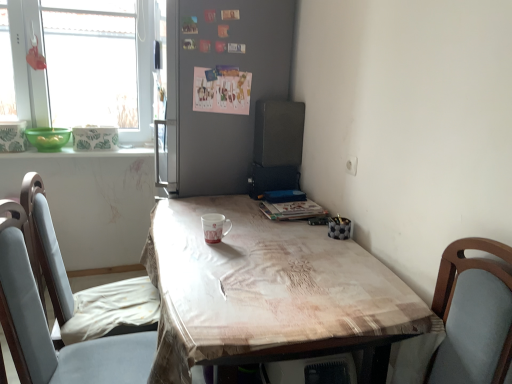
Where is `blank space situated above light brown fabric table at center (from a real-world perspective)`? blank space situated above light brown fabric table at center (from a real-world perspective) is located at coordinates [256, 251].